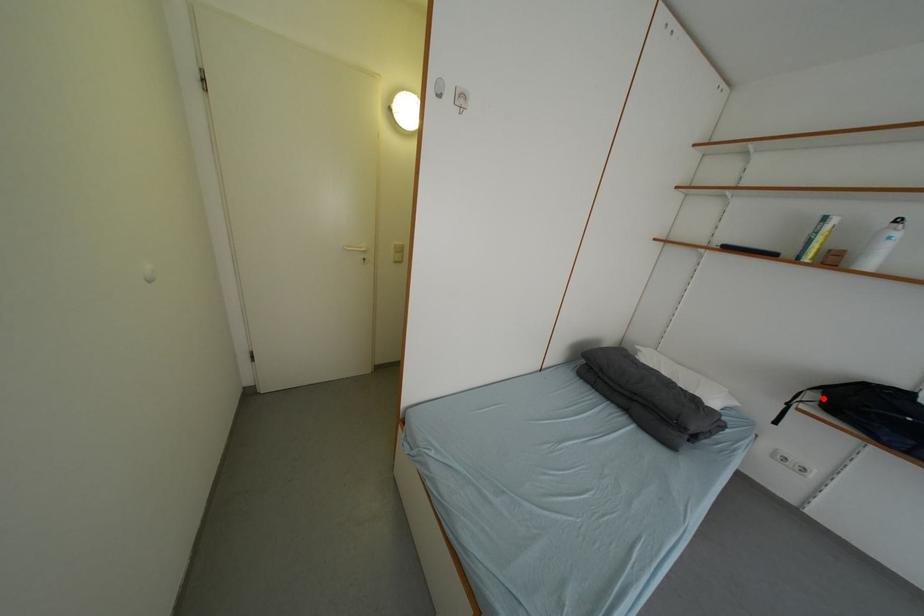
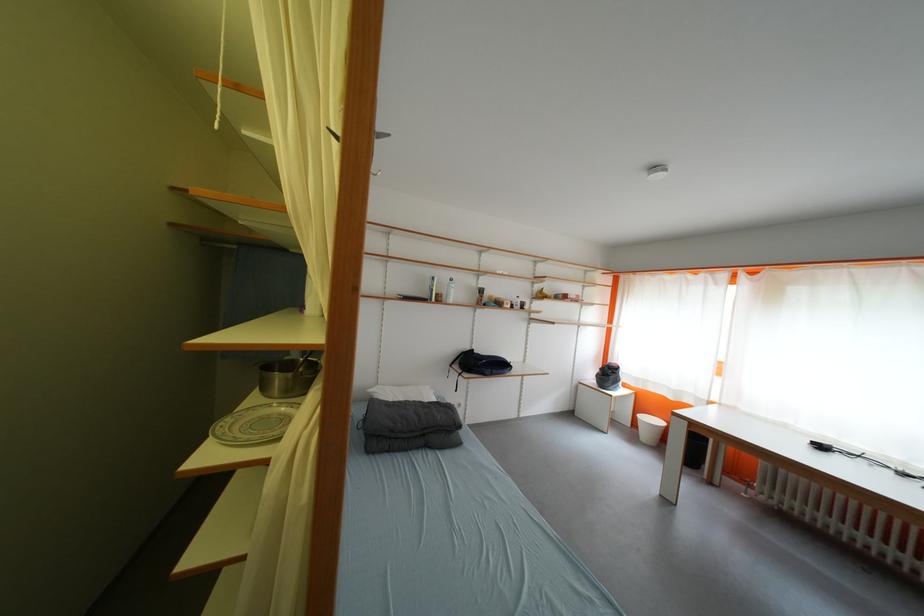
Question: I am providing you with two images of the same scene from different viewpoints. In image1, a red point is highlighted. Considering the same 3D point in image2, which of the following is correct?

Choices:
 (A) It is closer
 (B) It is farther

Answer: (B)